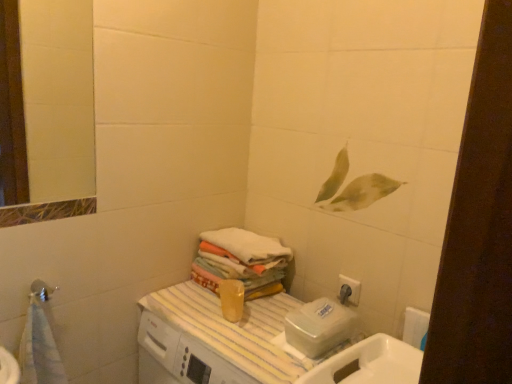
Question: Considering the positions of matte silver shower head at lower left and white matte toilet paper at lower right in the image, is matte silver shower head at lower left bigger or smaller than white matte toilet paper at lower right?

Choices:
 (A) big
 (B) small

Answer: (B)

Question: Choose the correct answer: Is matte silver shower head at lower left inside white matte toilet paper at lower right or outside it?

Choices:
 (A) inside
 (B) outside

Answer: (B)

Question: Estimate the real-world distances between objects in this image. Which object is closer to the matte silver shower head at lower left?

Choices:
 (A) white matte toilet paper at lower right
 (B) white glossy sink at lower right
 (C) white soft towel at center

Answer: (C)

Question: Which is farther from the white soft towel at center?

Choices:
 (A) white matte toilet paper at lower right
 (B) matte silver shower head at lower left
 (C) white glossy sink at lower right

Answer: (B)